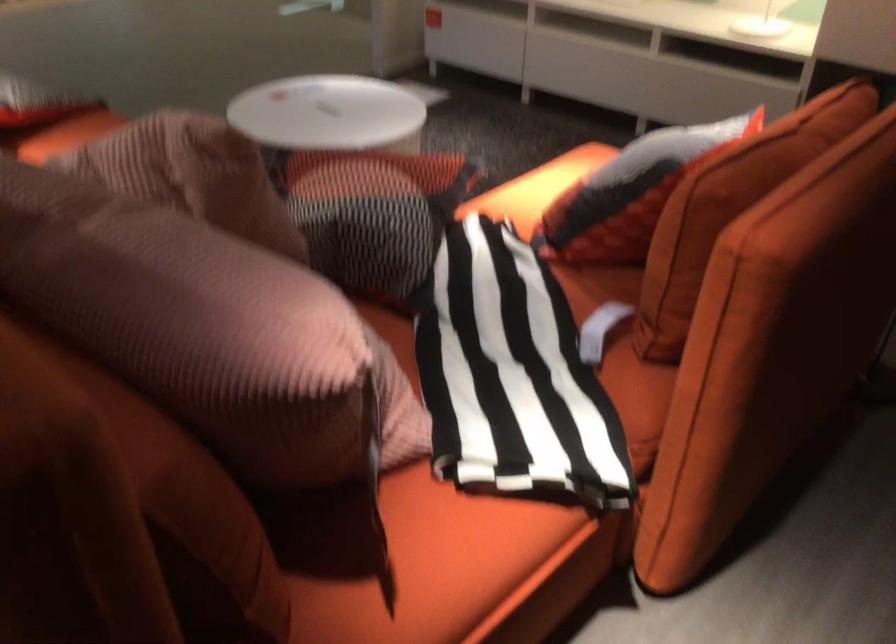
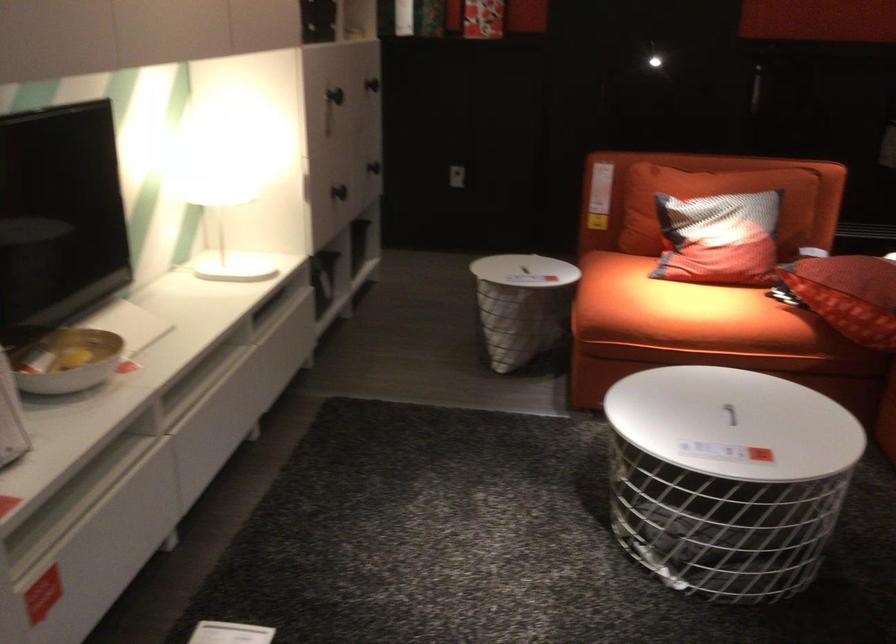
Where in the second image is the point corresponding to [333,116] from the first image?

(729, 413)